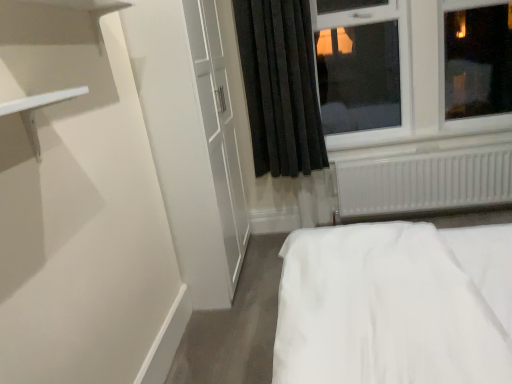
Question: In terms of width, does white plastic radiator at lower right look wider or thinner when compared to white plastic window at upper right?

Choices:
 (A) wide
 (B) thin

Answer: (B)

Question: Which is correct: white plastic radiator at lower right is inside white plastic window at upper right, or outside of it?

Choices:
 (A) inside
 (B) outside

Answer: (B)

Question: Which of these objects is positioned closest to the white plastic radiator at lower right?

Choices:
 (A) white plastic window at upper right
 (B) black velvet curtain at upper center

Answer: (A)

Question: Estimate the real-world distances between objects in this image. Which object is farther from the black velvet curtain at upper center?

Choices:
 (A) white plastic radiator at lower right
 (B) white plastic window at upper right

Answer: (A)